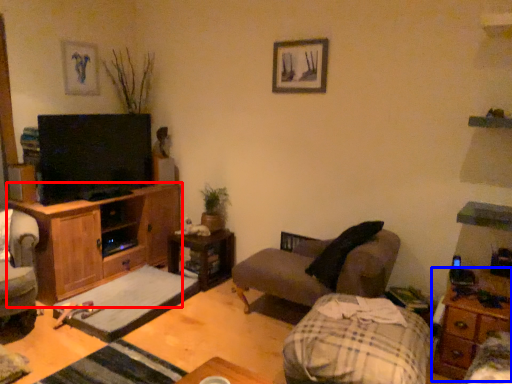
Question: Among these objects, which one is nearest to the camera, cabinetry (highlighted by a red box) or nightstand (highlighted by a blue box)?

Choices:
 (A) cabinetry
 (B) nightstand

Answer: (B)